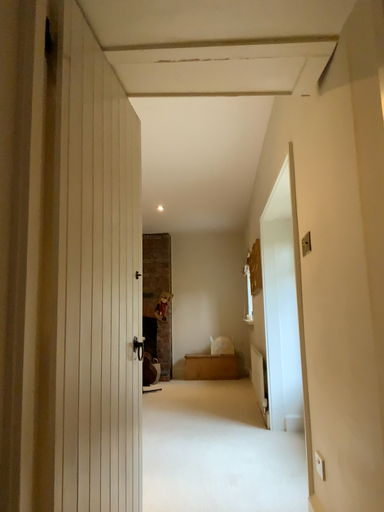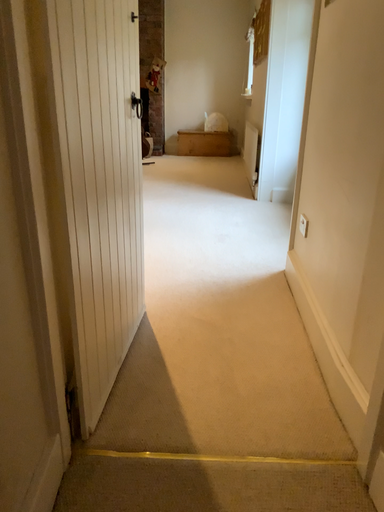
Question: Which way did the camera rotate in the video?

Choices:
 (A) rotated downward
 (B) rotated upward

Answer: (A)